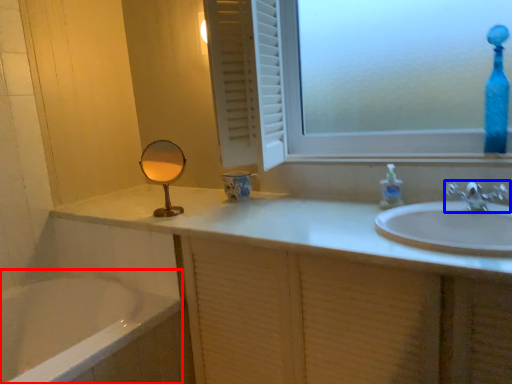
Question: Which point is further to the camera, bath (highlighted by a red box) or tap (highlighted by a blue box)?

Choices:
 (A) bath
 (B) tap

Answer: (B)